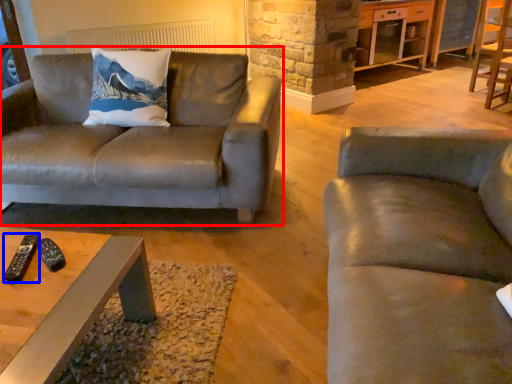
Question: Which of the following is the closest to the observer, studio couch (highlighted by a red box) or remote (highlighted by a blue box)?

Choices:
 (A) studio couch
 (B) remote

Answer: (B)